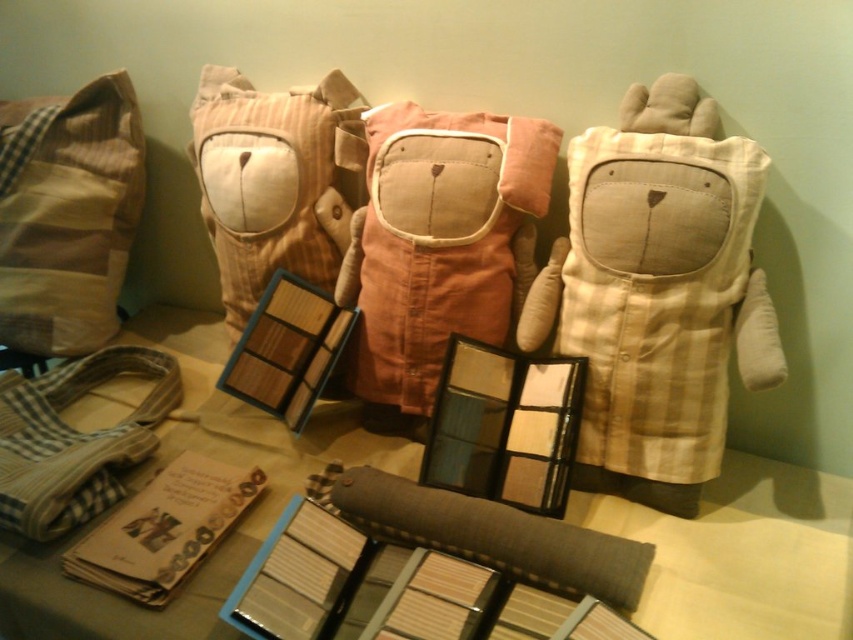
Question: Which of the following is the farthest from the observer?

Choices:
 (A) (109, 502)
 (B) (10, 332)
 (C) (463, 168)
 (D) (728, 484)

Answer: (B)

Question: Is matte orange fabric bag at center below brown plaid pillow at left?

Choices:
 (A) yes
 (B) no

Answer: (A)

Question: Which of the following is the farthest from the observer?

Choices:
 (A) striped fabric pillow at center
 (B) checkered fabric bag at lower left

Answer: (A)

Question: Does matte plastic palette at center appear on the left side of brown plaid pillow at left?

Choices:
 (A) yes
 (B) no

Answer: (B)

Question: Does brown plaid pillow at left have a greater width compared to checkered fabric bag at lower left?

Choices:
 (A) no
 (B) yes

Answer: (B)

Question: Which point is closer to the camera?

Choices:
 (A) striped fabric pillow at center
 (B) brown textured pillow at center
 (C) brown plaid pillow at left

Answer: (B)